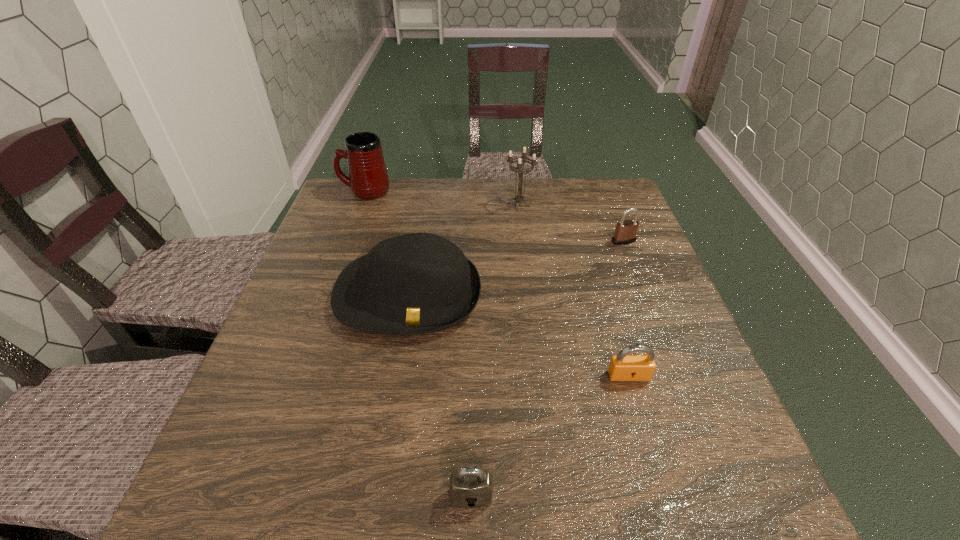
The image size is (960, 540). I want to click on mug, so click(368, 178).

You are a GUI agent. You are given a task and a screenshot of the screen. Output one action in this format:
    pyautogui.click(x=<x>, y=<y>)
    Task: Click on the fourth object from left to right
    Image resolution: width=960 pixels, height=540 pixels.
    Given the screenshot: What is the action you would take?
    pyautogui.click(x=519, y=198)

You are a GUI agent. You are given a task and a screenshot of the screen. Output one action in this format:
    pyautogui.click(x=<x>, y=<y>)
    Task: Click on the third nearest object
    The width and height of the screenshot is (960, 540).
    Given the screenshot: What is the action you would take?
    pyautogui.click(x=418, y=283)

The height and width of the screenshot is (540, 960). In order to click on the third tallest object in this screenshot , I will do `click(418, 283)`.

This screenshot has height=540, width=960. Find the location of `the rightmost object`. the rightmost object is located at coordinates (625, 233).

Where is `the rightmost padlock`? The height and width of the screenshot is (540, 960). the rightmost padlock is located at coordinates (625, 233).

The height and width of the screenshot is (540, 960). What are the coordinates of `the fifth object from left to right` in the screenshot? It's located at (623, 367).

Where is `the second farthest padlock`? This screenshot has width=960, height=540. the second farthest padlock is located at coordinates (623, 367).

At what (x,y) coordinates should I click in order to perform the action: click on the nearest object. Please return your answer as a coordinate pair (x, y). Image resolution: width=960 pixels, height=540 pixels. Looking at the image, I should click on tap(470, 487).

Image resolution: width=960 pixels, height=540 pixels. What are the coordinates of `the leftmost padlock` in the screenshot? It's located at (470, 487).